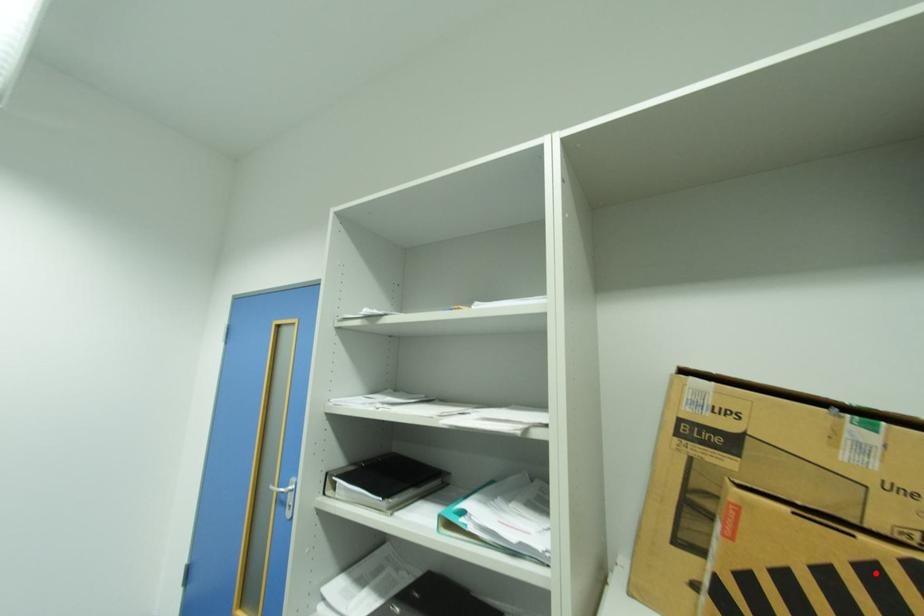
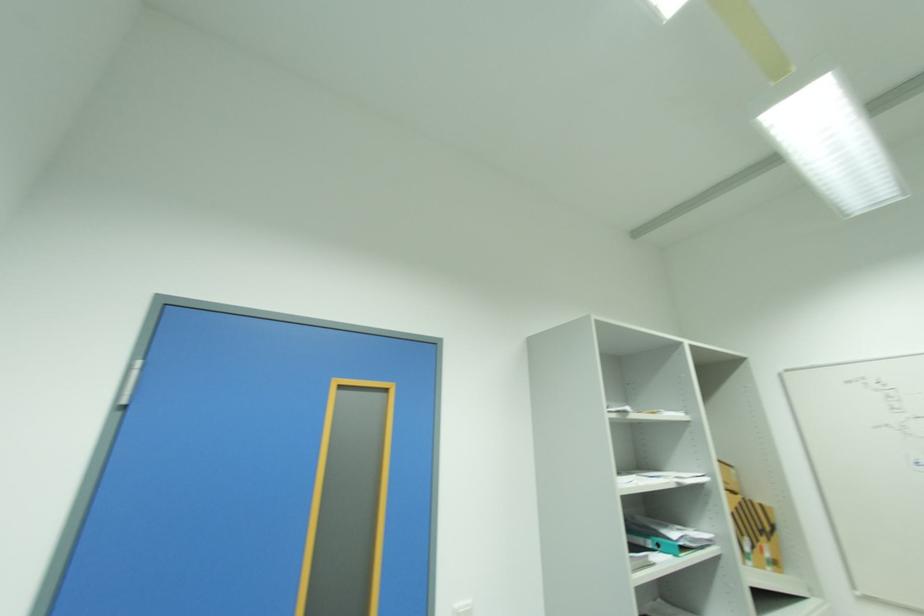
The point at the highlighted location is marked in the first image. Where is the corresponding point in the second image?

(746, 506)